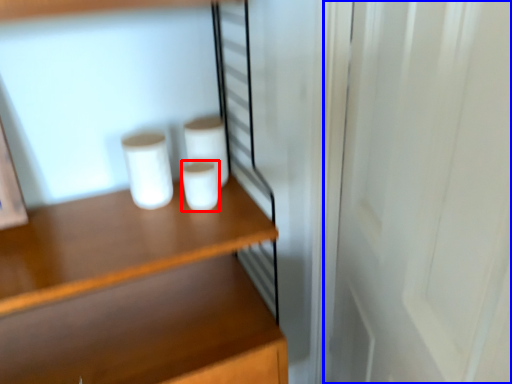
Question: Which point is further to the camera, paper towel (highlighted by a red box) or screen door (highlighted by a blue box)?

Choices:
 (A) paper towel
 (B) screen door

Answer: (A)